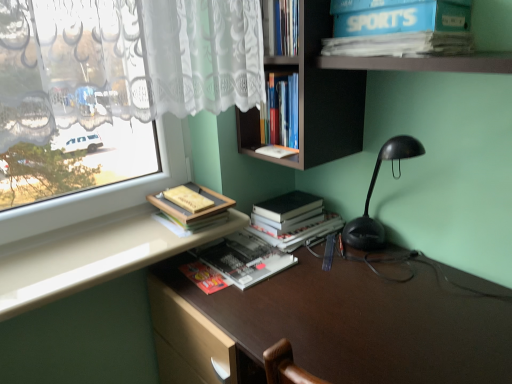
Where is `blank space situated above hardcover book at center, which appears as the 1th book when ordered from the bottom (from a real-world perspective)`? blank space situated above hardcover book at center, which appears as the 1th book when ordered from the bottom (from a real-world perspective) is located at coordinates (228, 255).